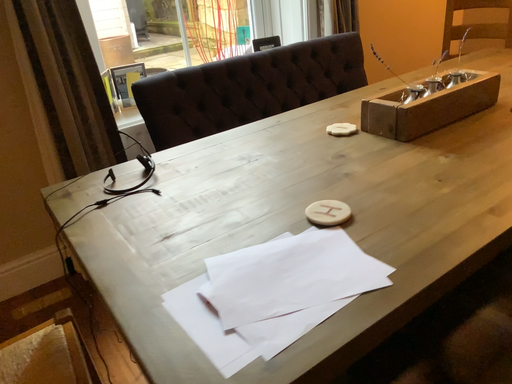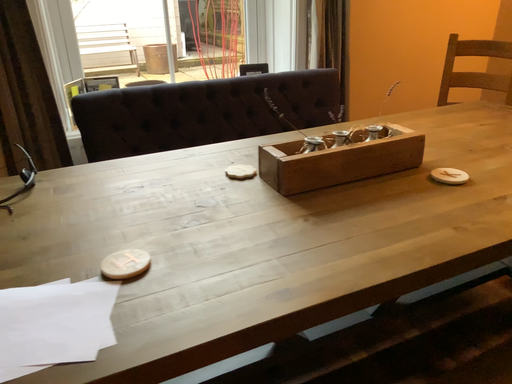
Question: Which way did the camera rotate in the video?

Choices:
 (A) rotated left
 (B) rotated right

Answer: (A)